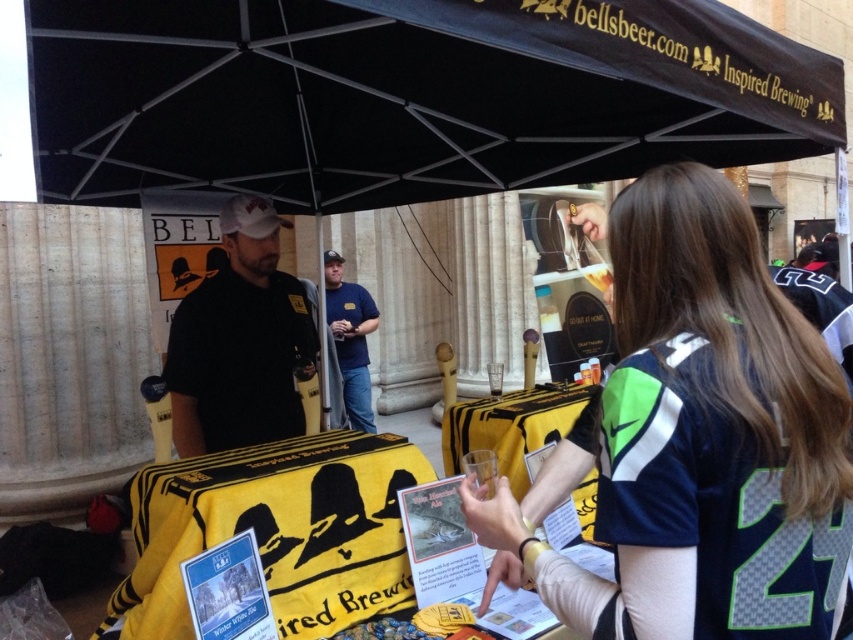
You are at an outdoor event and want to stay under the shade. There is a black fabric umbrella at upper center and a yellow fabric towel at center. Which object provides more shade?

The black fabric umbrella at upper center is in front of the yellow fabric towel at center, so it blocks more sunlight and provides more shade.

You are a photographer trying to capture the man under the canopy. You notice the black matte shirt at center and the blue denim jeans at center. Which item is positioned closer to the camera?

The black matte shirt at center is closer to the viewer than the blue denim jeans at center, so the black matte shirt at center is positioned closer to the camera.

You are organizing a clothing swap event and need to ensure that all items fit into a storage box that can only accommodate items wider than 30 cm. You have a black matte shirt at center and a blue denim jeans at center. Based on their widths, which item is more likely to fit into the box?

The black matte shirt at center has a larger width than the blue denim jeans at center. Since the box requires items wider than 30 cm, the black matte shirt at center is more likely to fit into the box if its width meets the requirement, but the jeans might be narrower and thus not qualify.